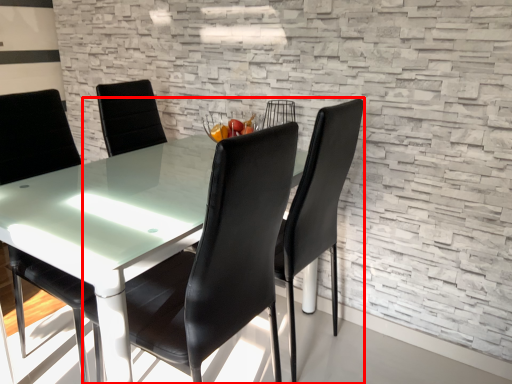
Question: Considering the relative positions of chair (annotated by the red box) and chair in the image provided, where is chair (annotated by the red box) located with respect to the staircase?

Choices:
 (A) left
 (B) right

Answer: (B)